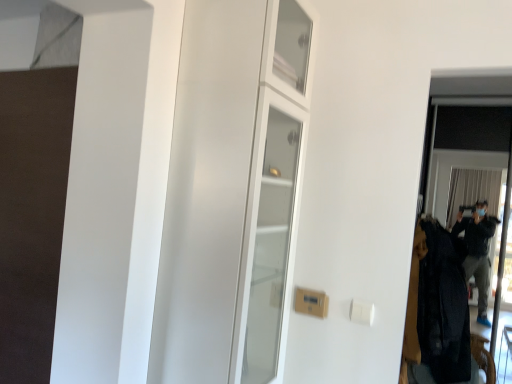
Question: Based on their positions, is transparent glass screen door at right located to the left or right of dark woolen coat at right?

Choices:
 (A) right
 (B) left

Answer: (A)

Question: Is point (502, 81) positioned closer to the camera than point (438, 279)?

Choices:
 (A) farther
 (B) closer

Answer: (B)

Question: Based on their relative distances, which object is farther from the white glossy cabinet at center?

Choices:
 (A) dark woolen coat at right
 (B) transparent glass screen door at right

Answer: (B)

Question: Estimate the real-world distances between objects in this image. Which object is closer to the white glossy cabinet at center?

Choices:
 (A) dark woolen coat at right
 (B) transparent glass screen door at right

Answer: (A)